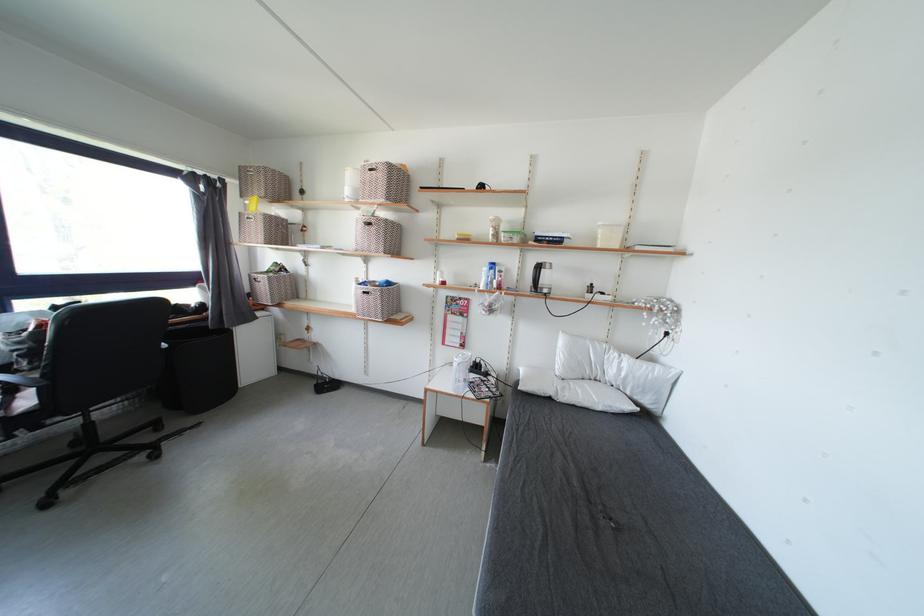
This screenshot has height=616, width=924. What do you see at coordinates (544, 273) in the screenshot? I see `the black kettle handle` at bounding box center [544, 273].